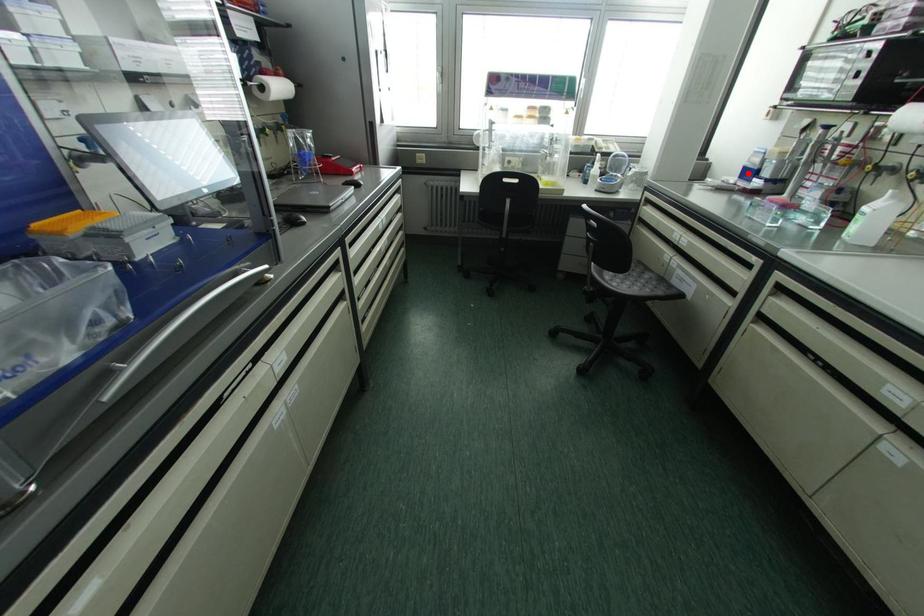
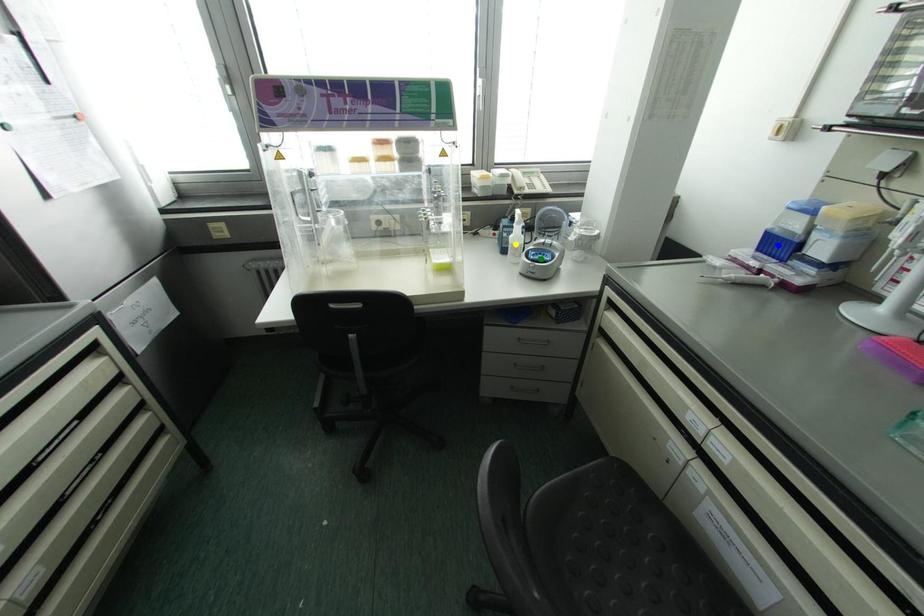
Question: I am providing you with two images of the same scene from different viewpoints. A red point is marked on the first image. You are given multiple points on the second image. Which mark in image 2 goes with the point in image 1?

Choices:
 (A) blue point
 (B) green point
 (C) yellow point

Answer: (A)